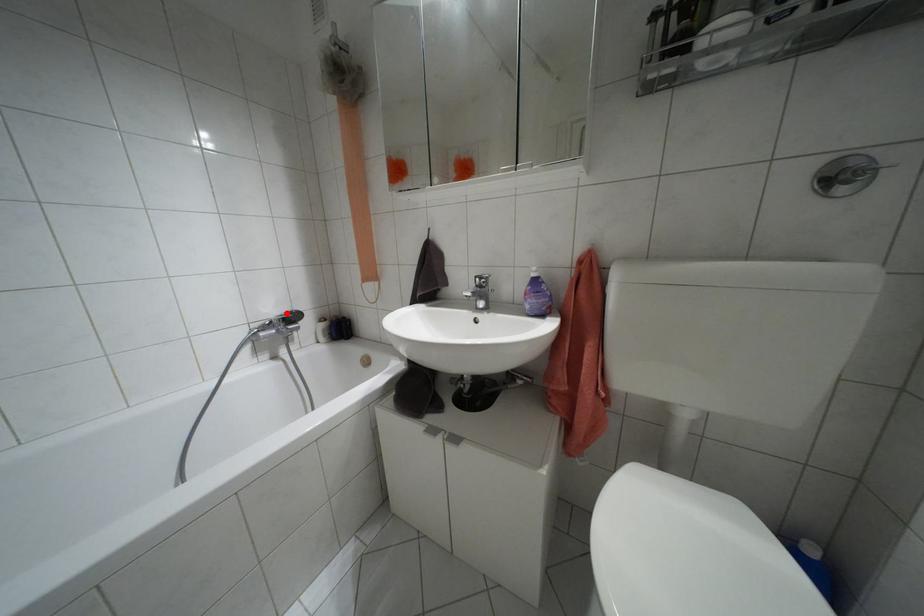
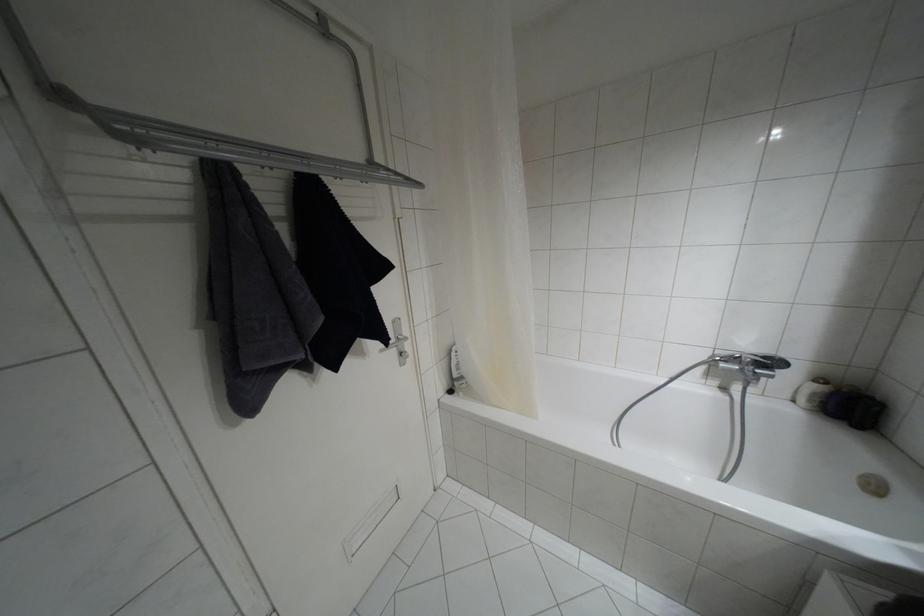
The point at the highlighted location is marked in the first image. Where is the corresponding point in the second image?

(763, 357)